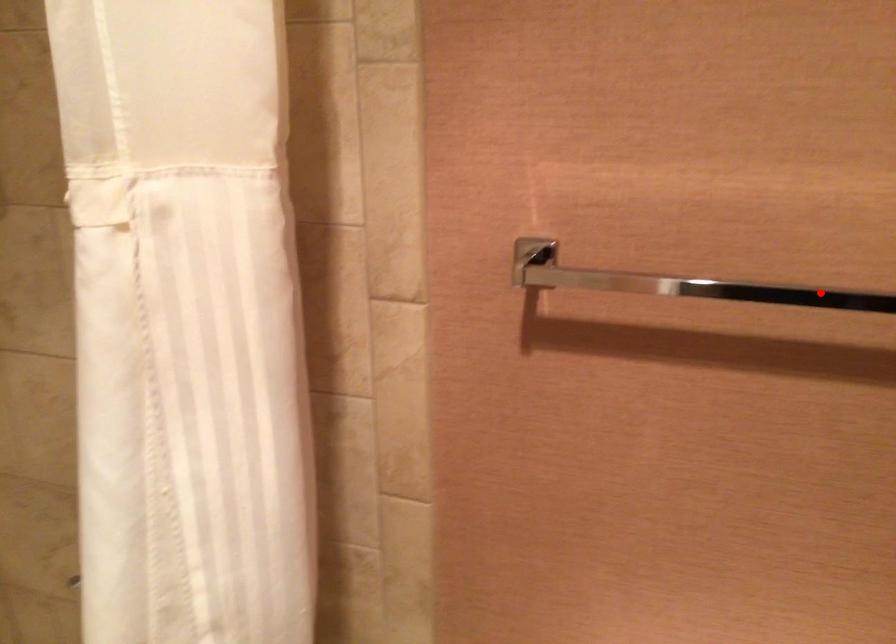
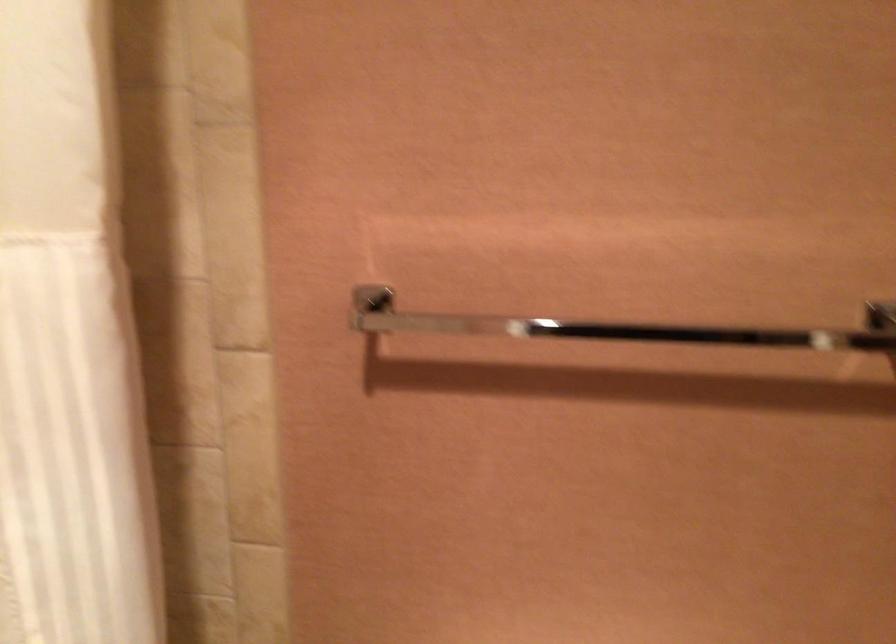
Question: I am providing you with two images of the same scene from different viewpoints. Given a red point in image1, look at the same physical point in image2. Is it:

Choices:
 (A) Closer to the viewpoint
 (B) Farther from the viewpoint

Answer: (B)